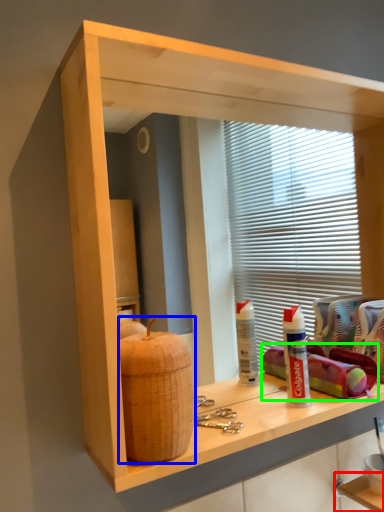
Question: Which is farther away from shelf (highlighted by a red box)? basket (highlighted by a blue box) or material (highlighted by a green box)?

Choices:
 (A) basket
 (B) material

Answer: (A)